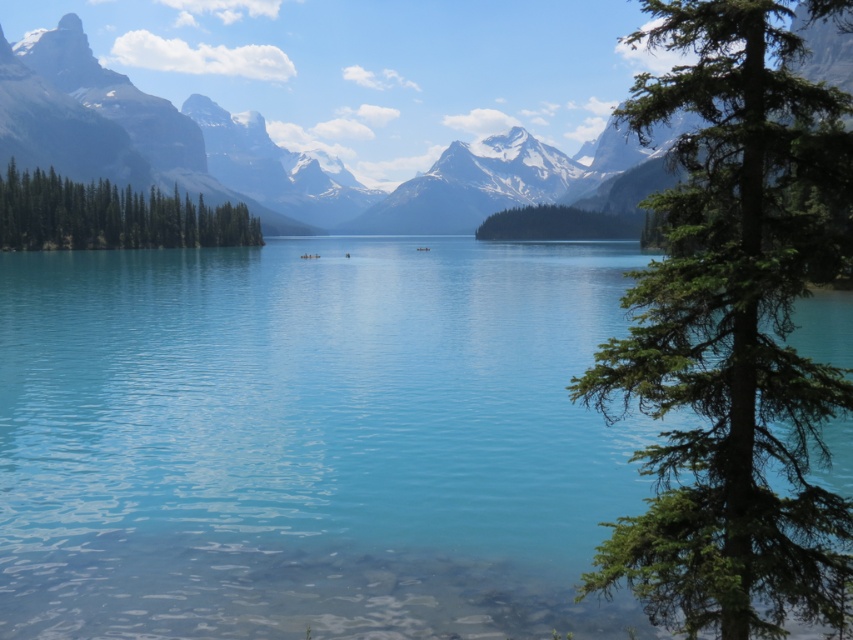
Does clear blue water at center appear over green textured island at center?

No, clear blue water at center is not above green textured island at center.

Is clear blue water at center closer to the viewer compared to green textured island at center?

Yes, clear blue water at center is closer to the viewer.

Identify the location of clear blue water at center. This screenshot has width=853, height=640. (310, 440).

Image resolution: width=853 pixels, height=640 pixels. What do you see at coordinates (310, 440) in the screenshot? I see `clear blue water at center` at bounding box center [310, 440].

Which of these two, clear blue water at center or green matte tree at left, stands taller?

clear blue water at center is taller.

Is point (566, 504) behind point (88, 211)?

No, (566, 504) is in front of (88, 211).

Identify the location of clear blue water at center. This screenshot has width=853, height=640. (310, 440).

Can you confirm if smooth granite mountain at center is thinner than green textured island at center?

No, smooth granite mountain at center is not thinner than green textured island at center.

Consider the image. Is smooth granite mountain at center in front of green textured island at center?

Yes, smooth granite mountain at center is in front of green textured island at center.

The image size is (853, 640). Find the location of `smooth granite mountain at center`. smooth granite mountain at center is located at coordinates (405, 180).